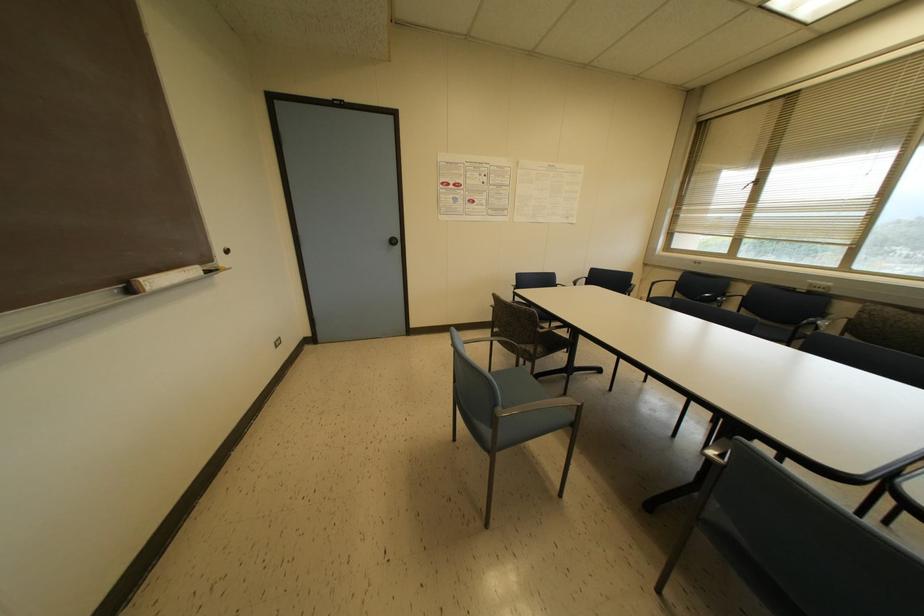
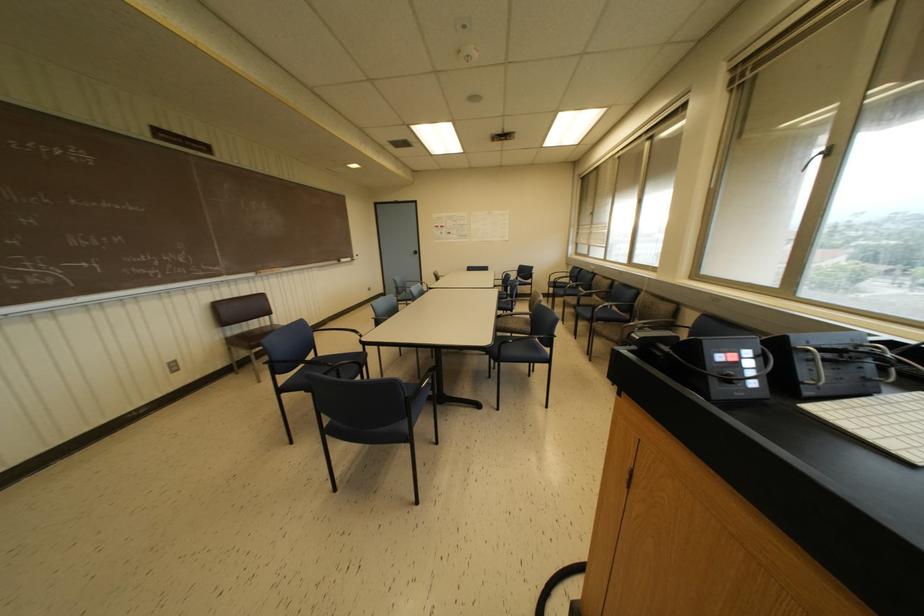
Which direction would the cameraman need to move to produce the second image?

The cameraman walked toward right, backward.